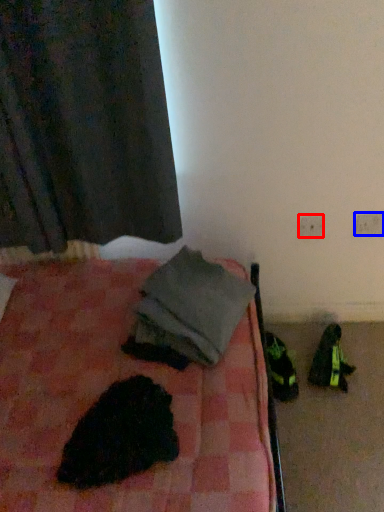
Question: Which point is closer to the camera, electric outlet (highlighted by a red box) or electric outlet (highlighted by a blue box)?

Choices:
 (A) electric outlet
 (B) electric outlet

Answer: (B)